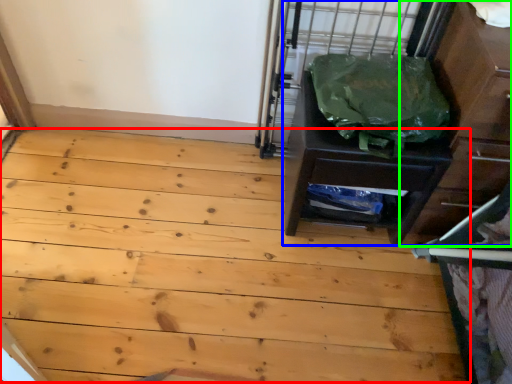
Question: Considering the real-world distances, which object is closest to plywood (highlighted by a red box)? chest of drawers (highlighted by a blue box) or dresser (highlighted by a green box).

Choices:
 (A) chest of drawers
 (B) dresser

Answer: (A)